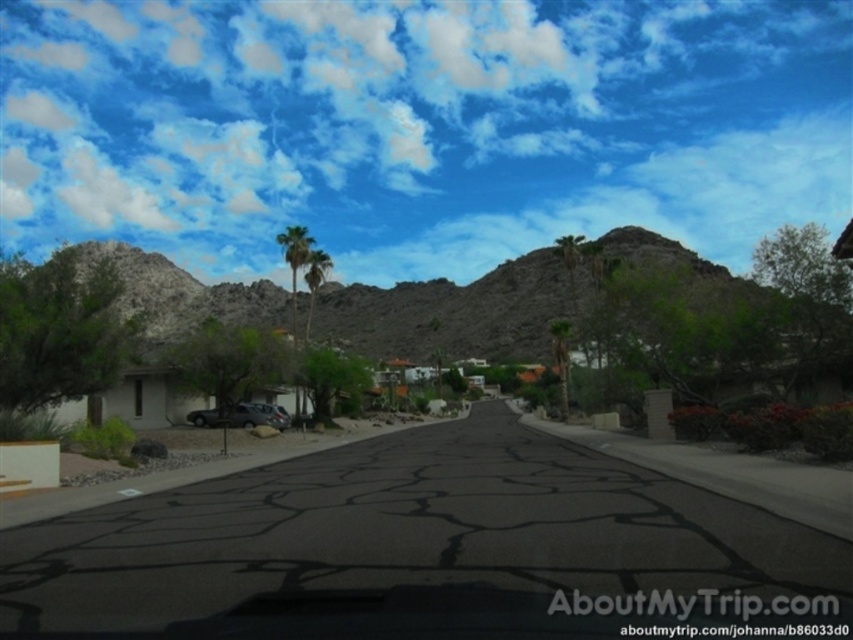
Question: Considering the real-world distances, which object is farthest from the green leafy palm tree at center?

Choices:
 (A) white fluffy cloud at upper center
 (B) dark gray metallic suv at center
 (C) white fluffy cloud at upper left
 (D) rocky brown mountain at center

Answer: (A)

Question: Which object is farther from the camera taking this photo?

Choices:
 (A) green leafy palm tree at center
 (B) rocky brown mountain at center
 (C) white fluffy cloud at upper center
 (D) dark gray metallic suv at center

Answer: (C)

Question: Does white fluffy cloud at upper left have a lesser width compared to dark gray metallic suv at center?

Choices:
 (A) no
 (B) yes

Answer: (A)

Question: Which of the following is the closest to the observer?

Choices:
 (A) (686, 276)
 (B) (234, 420)
 (C) (294, 232)
 (D) (314, 230)

Answer: (A)

Question: In this image, where is white fluffy cloud at upper center located relative to white fluffy cloud at upper left?

Choices:
 (A) above
 (B) below

Answer: (A)

Question: Does rocky brown mountain at center have a smaller size compared to dark gray metallic suv at center?

Choices:
 (A) no
 (B) yes

Answer: (A)